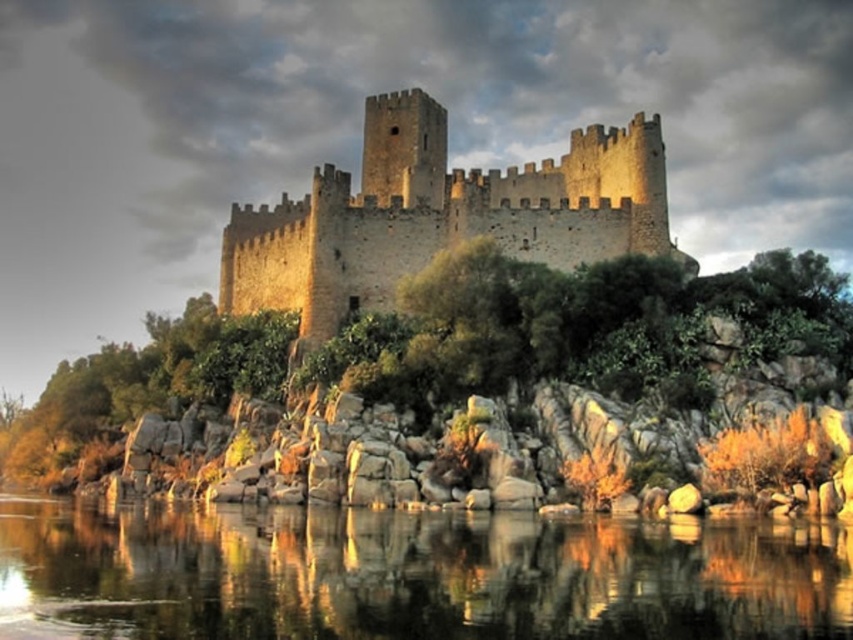
You are a knight approaching the brown stone castle at center from the lower edge of the image. There is transparent water at lower center between you and the castle. Can you cross the water to reach the castle?

The transparent water at lower center might be wider than brown stone castle at center, so it is uncertain if the knight can cross the water to reach the castle.

You are a knight standing at the edge of the transparent water at lower center. You need to reach the brown stone castle at center to deliver a message. Which direction should you head towards relative to your current position?

You should head to the right because the transparent water at lower center is to the left of the brown stone castle at center, so moving right will take you towards the castle.

You are a tourist standing at the edge of the transparent water at lower center, looking towards the brown stone castle at center. Which direction should you walk to get closer to the castle?

You should walk towards the brown stone castle at center. Since the transparent water at lower center is closer to you, moving away from the water towards the castle will bring you closer to the brown stone castle at center.